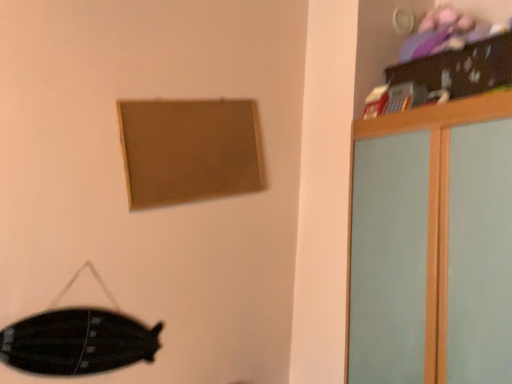
Question: Can you confirm if black matte swivel chair at lower left is shorter than light wood dresser at upper right?

Choices:
 (A) yes
 (B) no

Answer: (A)

Question: Is black matte swivel chair at lower left taller than light wood dresser at upper right?

Choices:
 (A) yes
 (B) no

Answer: (B)

Question: Is black matte swivel chair at lower left far away from light wood dresser at upper right?

Choices:
 (A) yes
 (B) no

Answer: (A)

Question: From the image's perspective, would you say black matte swivel chair at lower left is shown under light wood dresser at upper right?

Choices:
 (A) yes
 (B) no

Answer: (A)

Question: Is black matte swivel chair at lower left closer to the viewer compared to light wood dresser at upper right?

Choices:
 (A) yes
 (B) no

Answer: (B)

Question: Visually, is light wood dresser at upper right positioned to the left or to the right of black matte swivel chair at lower left?

Choices:
 (A) right
 (B) left

Answer: (A)

Question: Looking at their shapes, would you say light wood dresser at upper right is wider or thinner than black matte swivel chair at lower left?

Choices:
 (A) thin
 (B) wide

Answer: (B)

Question: Is light wood dresser at upper right inside or outside of black matte swivel chair at lower left?

Choices:
 (A) inside
 (B) outside

Answer: (B)

Question: From the image's perspective, is light wood dresser at upper right located above or below black matte swivel chair at lower left?

Choices:
 (A) above
 (B) below

Answer: (A)

Question: Is matte brown picture frame at upper center wider or thinner than black matte swivel chair at lower left?

Choices:
 (A) wide
 (B) thin

Answer: (A)

Question: From their relative heights in the image, would you say matte brown picture frame at upper center is taller or shorter than black matte swivel chair at lower left?

Choices:
 (A) short
 (B) tall

Answer: (B)

Question: From a real-world perspective, relative to black matte swivel chair at lower left, is matte brown picture frame at upper center vertically above or below?

Choices:
 (A) above
 (B) below

Answer: (A)

Question: From the image's perspective, is matte brown picture frame at upper center above or below black matte swivel chair at lower left?

Choices:
 (A) above
 (B) below

Answer: (A)

Question: Is matte brown picture frame at upper center taller or shorter than light wood dresser at upper right?

Choices:
 (A) short
 (B) tall

Answer: (A)

Question: Considering the relative positions of matte brown picture frame at upper center and light wood dresser at upper right in the image provided, is matte brown picture frame at upper center to the left or to the right of light wood dresser at upper right?

Choices:
 (A) left
 (B) right

Answer: (A)